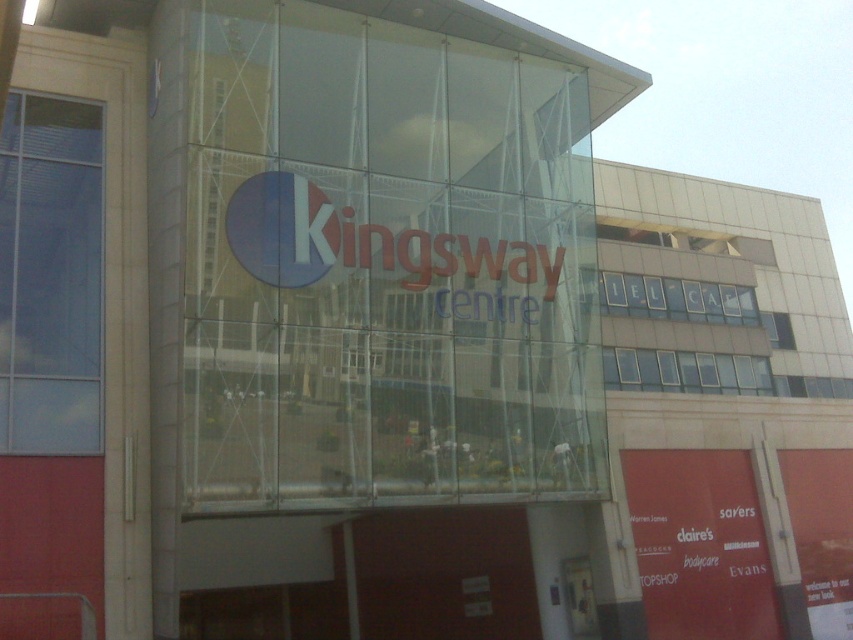
You are a customer standing in front of the Kingsway Centre. You see the transparent glass kingsway centre sign at center and the matte red sign at lower right. Which sign is located above the other?

The transparent glass kingsway centre sign at center is positioned over the matte red sign at lower right, so it is above the other sign.

You are a window cleaner standing at the base of the Kingsway Centre building. You need to clean both the transparent glass kingsway centre sign at center and the matte red sign at lower right. Which sign will require you to climb higher to reach?

The transparent glass kingsway centre sign at center requires climbing higher because it has a greater height compared to the matte red sign at lower right.